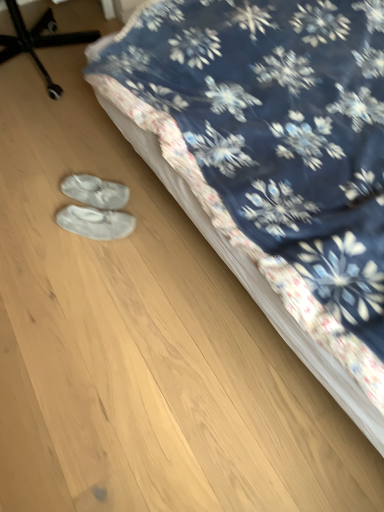
Identify the location of vacant space positioned to the left of white suede slippers at lower center, the first footwear from the bottom. (39, 233).